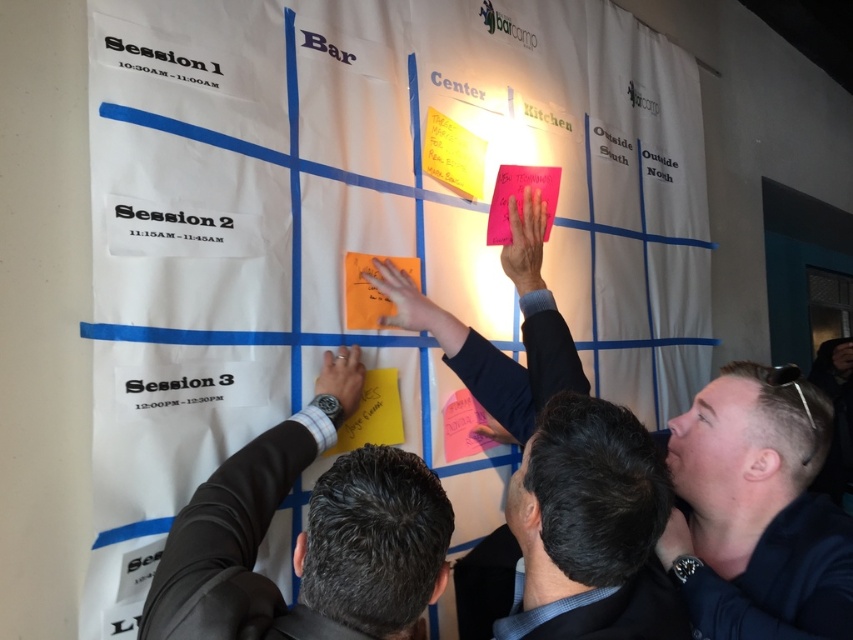
You are standing in the room where the brainstorming session is happening. You need to locate the person with dark brown hair at center. Where exactly is this person located in the room?

The dark brown hair at center is located at point (590, 529) in the room.

You are a participant in the brainstorming session and need to check the time. You see the white paper at center and the matte black watch at lower left. Which object is closer to the right side of the image?

The white paper at center is to the right of the matte black watch at lower left, so the white paper at center is closer to the right side of the image.

You are part of the brainstorming team and need to check the time. You see the white paper at center and the matte black watch at lower left. Which object is taller?

The white paper at center is taller than the matte black watch at lower left.